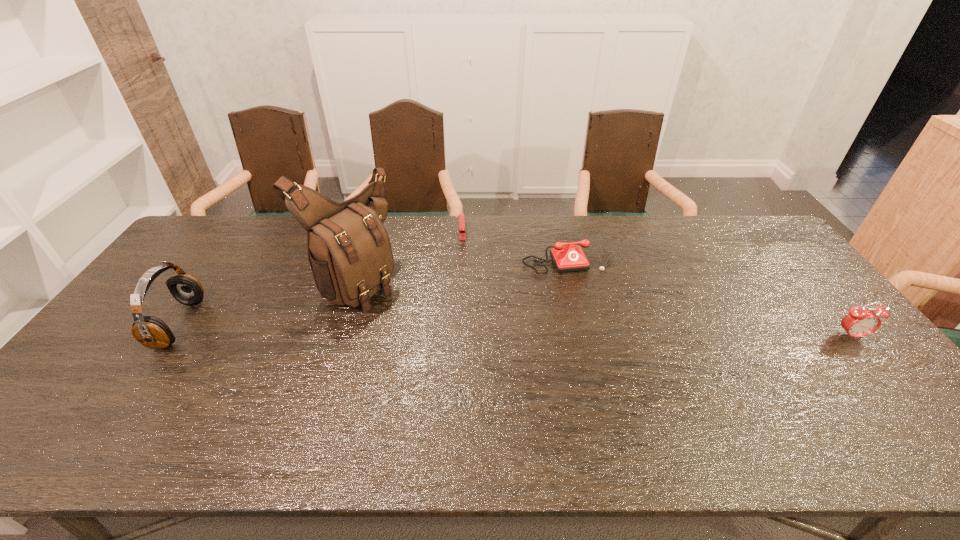
Locate an element on the screen. The width and height of the screenshot is (960, 540). the second tallest object is located at coordinates (152, 332).

The width and height of the screenshot is (960, 540). Find the location of `the leftmost object`. the leftmost object is located at coordinates (152, 332).

Where is `the third shortest object`? The width and height of the screenshot is (960, 540). the third shortest object is located at coordinates (860, 322).

The image size is (960, 540). In order to click on alarm clock in this screenshot , I will do `click(860, 322)`.

I want to click on the shortest object, so click(x=461, y=215).

The image size is (960, 540). Find the location of `stapler`. stapler is located at coordinates (461, 215).

Where is `the fourth object from right to left`? The width and height of the screenshot is (960, 540). the fourth object from right to left is located at coordinates (349, 250).

This screenshot has width=960, height=540. I want to click on the tallest object, so click(x=349, y=250).

In order to click on the fourth object from left to right in this screenshot , I will do `click(569, 258)`.

Locate an element on the screen. This screenshot has width=960, height=540. telephone is located at coordinates pos(569,258).